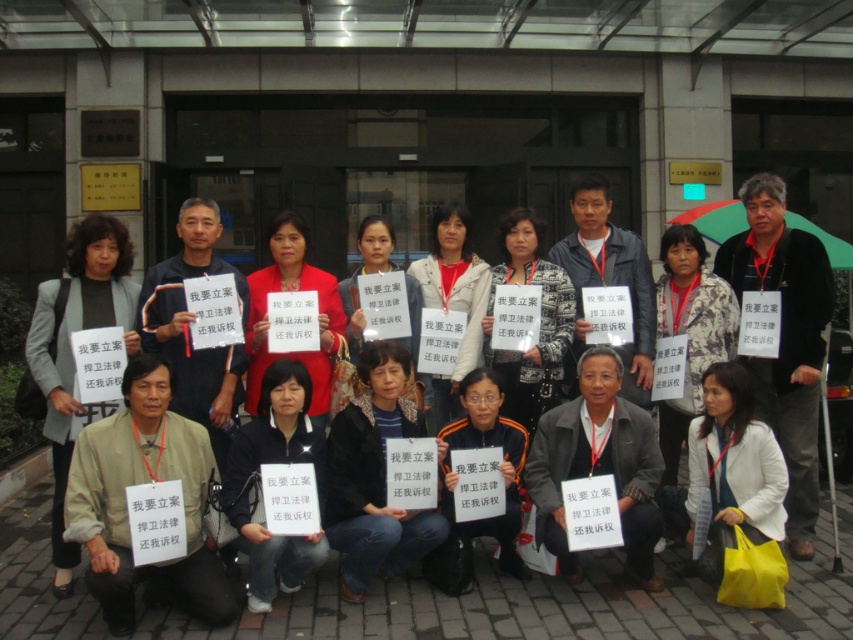
Who is more forward, (521, 250) or (631, 348)?

Point (631, 348) is more forward.

Is matte black sign at center to the right of matte gray shirt at center from the viewer's perspective?

No, matte black sign at center is not to the right of matte gray shirt at center.

Describe the element at coordinates (538, 323) in the screenshot. I see `matte black sign at center` at that location.

Where is `matte black sign at center`? matte black sign at center is located at coordinates (538, 323).

Does point (100, 268) come behind point (561, 310)?

No, (100, 268) is in front of (561, 310).

Who is more forward, [56,301] or [558,292]?

Positioned in front is point [56,301].

Locate an element on the screen. The height and width of the screenshot is (640, 853). matte gray blazer at center is located at coordinates (70, 348).

Does black fabric jacket at center appear over matte red coat at center?

Actually, black fabric jacket at center is below matte red coat at center.

Measure the distance between black fabric jacket at center and camera.

black fabric jacket at center is 5.11 meters from camera.

Locate an element on the screen. The image size is (853, 640). black fabric jacket at center is located at coordinates (785, 339).

Find the location of a particular element. The height and width of the screenshot is (640, 853). black fabric jacket at center is located at coordinates (785, 339).